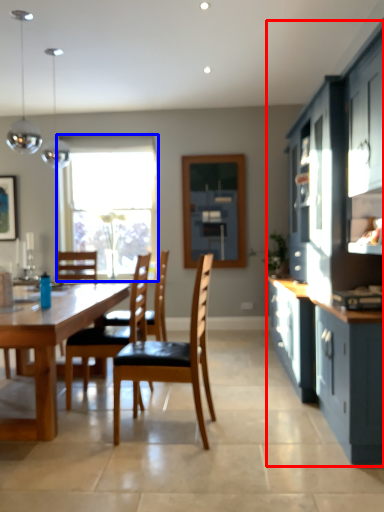
Question: Which of the following is the farthest to the observer, cabinetry (highlighted by a red box) or window (highlighted by a blue box)?

Choices:
 (A) cabinetry
 (B) window

Answer: (B)